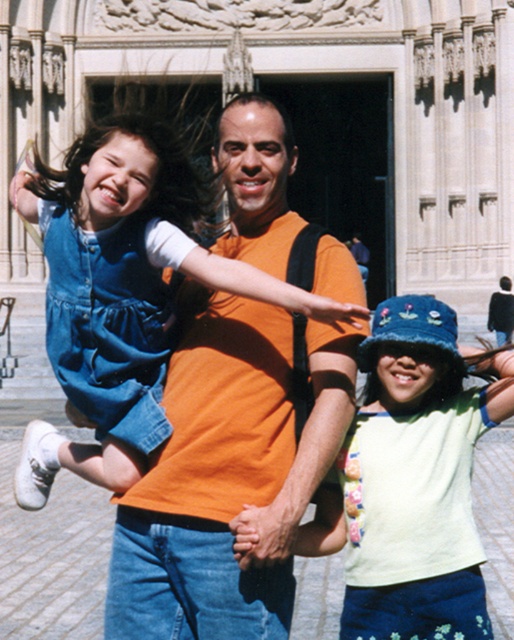
Question: Can you confirm if light green fabric shirt at center is positioned below denim dress at left?

Choices:
 (A) yes
 (B) no

Answer: (A)

Question: Which point appears farthest from the camera in this image?

Choices:
 (A) (464, 442)
 (B) (121, 404)

Answer: (A)

Question: From the image, what is the correct spatial relationship of light green fabric shirt at center in relation to denim dress at left?

Choices:
 (A) left
 (B) right

Answer: (B)

Question: Which object appears closest to the camera in this image?

Choices:
 (A) light green fabric shirt at center
 (B) denim dress at left

Answer: (A)

Question: Considering the relative positions of light green fabric shirt at center and denim dress at left in the image provided, where is light green fabric shirt at center located with respect to denim dress at left?

Choices:
 (A) below
 (B) above

Answer: (A)